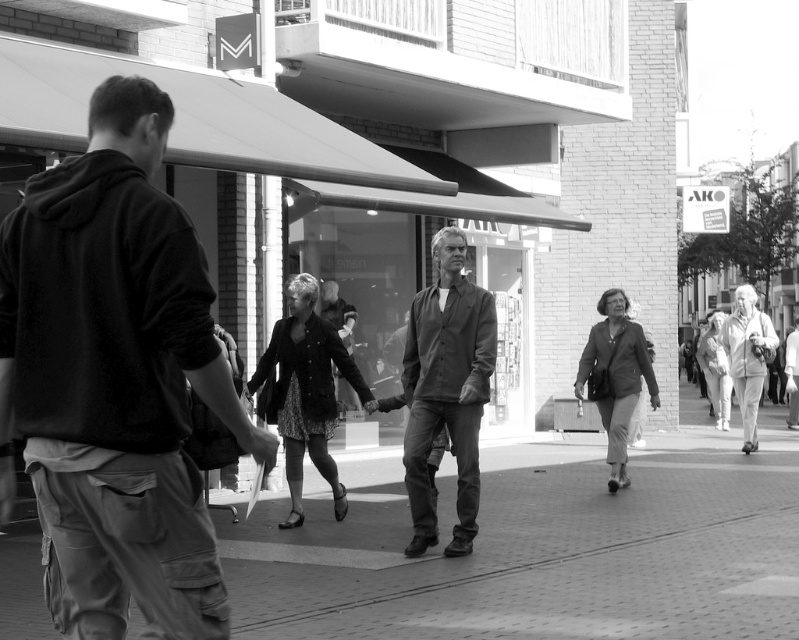
You are standing on the street in the image and looking at the brick pavement at center and the dark gray textured shirt at center. Which object is closer to the ground?

The brick pavement at center is closer to the ground because it is positioned below the dark gray textured shirt at center.

You are standing in the middle of the street in this urban scene. There are two points marked in the image. Which point, point (193, 365) or point (407, 356), is closer to you?

Point (193, 365) is closer to the viewer than point (407, 356).